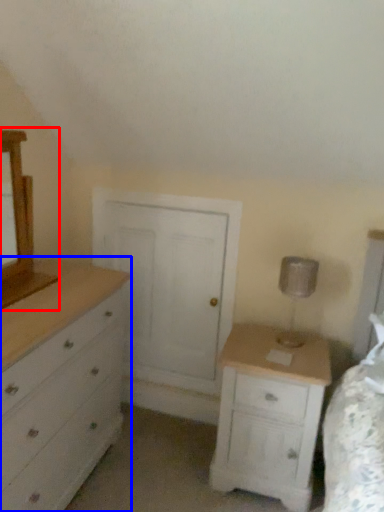
Question: Which object is closer to the camera taking this photo, medicine cabinet (highlighted by a red box) or chest of drawers (highlighted by a blue box)?

Choices:
 (A) medicine cabinet
 (B) chest of drawers

Answer: (B)